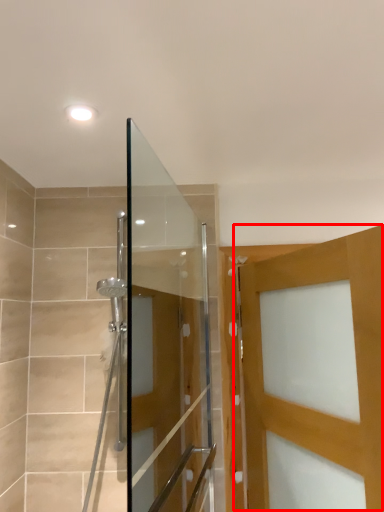
Question: From the image's perspective, considering the relative positions of door (annotated by the red box) and screen door in the image provided, where is door (annotated by the red box) located with respect to the staircase?

Choices:
 (A) above
 (B) below

Answer: (B)